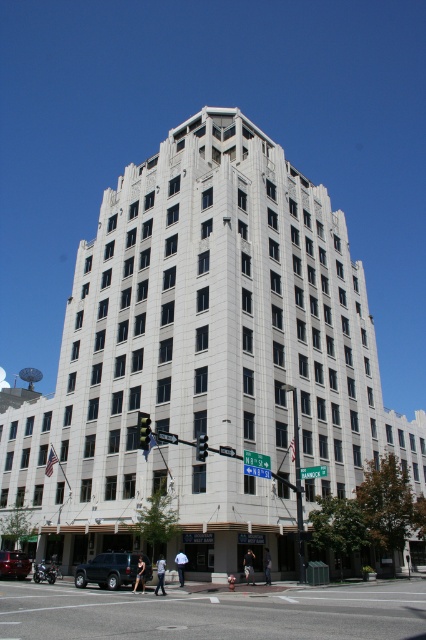
Between point (117, 582) and point (8, 566), which one is positioned behind?

The point (8, 566) is behind.

Looking at this image, is the position of black matte suv at lower left more distant than that of shiny silver sedan at lower left?

That is False.

Which is behind, point (123, 577) or point (8, 564)?

The point (8, 564) is behind.

At what (x,y) coordinates should I click in order to perform the action: click on black matte suv at lower left. Please return your answer as a coordinate pair (x, y). Image resolution: width=426 pixels, height=640 pixels. Looking at the image, I should click on (108, 570).

Between asphalt road at lower center and shiny silver sedan at lower left, which one has more height?

asphalt road at lower center is taller.

This screenshot has width=426, height=640. Describe the element at coordinates (213, 612) in the screenshot. I see `asphalt road at lower center` at that location.

Is point (164, 637) more distant than point (19, 577)?

No, (164, 637) is in front of (19, 577).

The height and width of the screenshot is (640, 426). I want to click on asphalt road at lower center, so click(213, 612).

From the picture: Can you confirm if asphalt road at lower center is smaller than black matte suv at lower left?

No.

What do you see at coordinates (213, 612) in the screenshot? I see `asphalt road at lower center` at bounding box center [213, 612].

Does point (339, 609) come farther from viewer compared to point (77, 579)?

No, it is not.

Where is `asphalt road at lower center`? asphalt road at lower center is located at coordinates (213, 612).